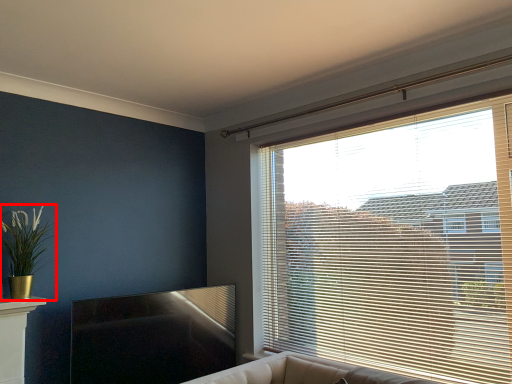
Question: From the image's perspective, considering the relative positions of houseplant (annotated by the red box) and window blind in the image provided, where is houseplant (annotated by the red box) located with respect to the staircase?

Choices:
 (A) below
 (B) above

Answer: (A)